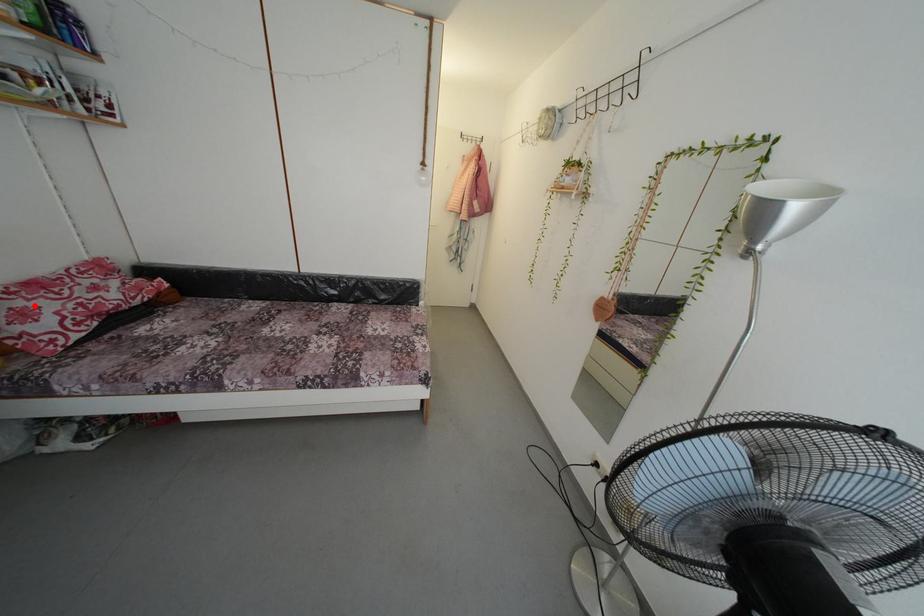
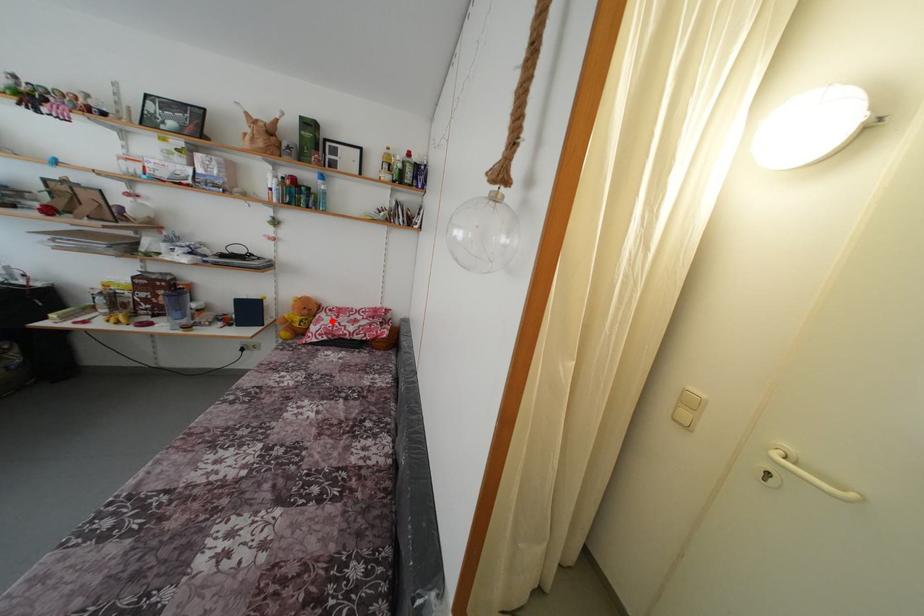
I am providing you with two images of the same scene from different viewpoints. A red point is marked on the first image and another point is marked on the second image. Are the points marked in image1 and image2 representing the same 3D position?

Yes